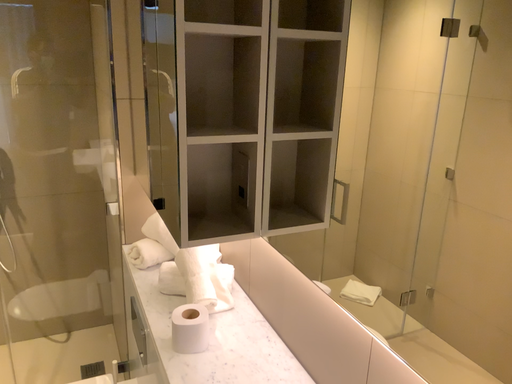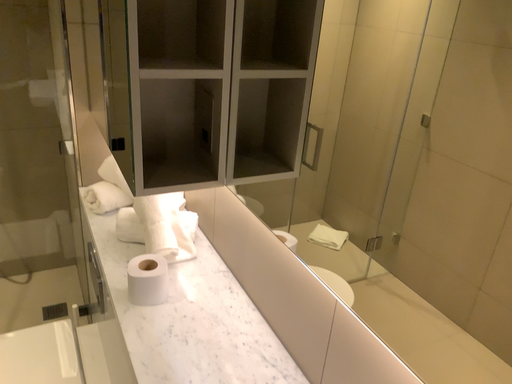
Question: Which way did the camera rotate in the video?

Choices:
 (A) rotated upward
 (B) rotated downward

Answer: (B)